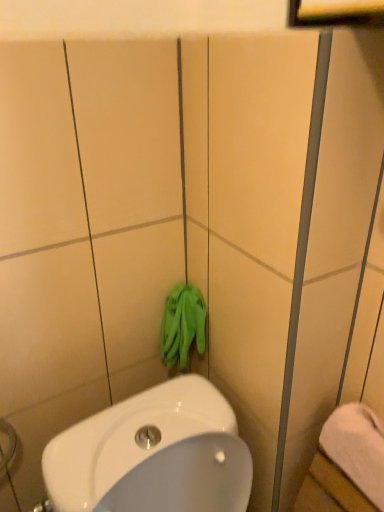
Question: Can green fabric gloves at center be found inside white soft towel at lower right?

Choices:
 (A) no
 (B) yes

Answer: (A)

Question: From the image's perspective, is white soft towel at lower right over green fabric gloves at center?

Choices:
 (A) no
 (B) yes

Answer: (A)

Question: Does white soft towel at lower right turn towards green fabric gloves at center?

Choices:
 (A) yes
 (B) no

Answer: (B)

Question: Is white soft towel at lower right thinner than green fabric gloves at center?

Choices:
 (A) yes
 (B) no

Answer: (B)

Question: Is white soft towel at lower right next to green fabric gloves at center and touching it?

Choices:
 (A) no
 (B) yes

Answer: (A)

Question: Does white soft towel at lower right lie behind green fabric gloves at center?

Choices:
 (A) no
 (B) yes

Answer: (A)

Question: Is green fabric gloves at center shorter than white soft towel at lower right?

Choices:
 (A) no
 (B) yes

Answer: (A)

Question: Does green fabric gloves at center appear on the right side of white soft towel at lower right?

Choices:
 (A) no
 (B) yes

Answer: (A)

Question: From a real-world perspective, is green fabric gloves at center beneath white soft towel at lower right?

Choices:
 (A) no
 (B) yes

Answer: (A)

Question: Is green fabric gloves at center positioned beyond the bounds of white soft towel at lower right?

Choices:
 (A) yes
 (B) no

Answer: (A)

Question: Considering the relative positions of green fabric gloves at center and white soft towel at lower right in the image provided, is green fabric gloves at center in front of white soft towel at lower right?

Choices:
 (A) no
 (B) yes

Answer: (A)

Question: Is green fabric gloves at center aimed at white soft towel at lower right?

Choices:
 (A) no
 (B) yes

Answer: (B)

Question: In terms of height, does white soft towel at lower right look taller or shorter compared to green fabric gloves at center?

Choices:
 (A) short
 (B) tall

Answer: (A)